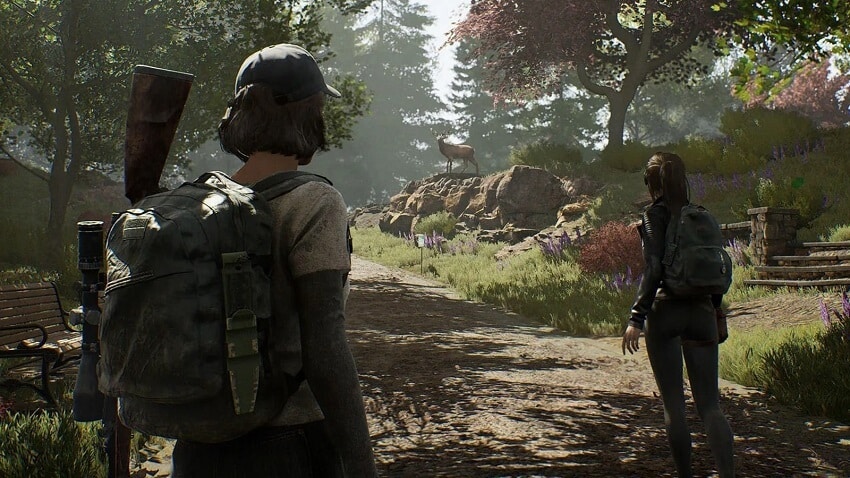
At what (x,y) coordinates should I click in order to perform the action: click on wooden handle. Please return your answer as a coordinate pair (x, y). This screenshot has height=478, width=850. Looking at the image, I should click on (171, 140).